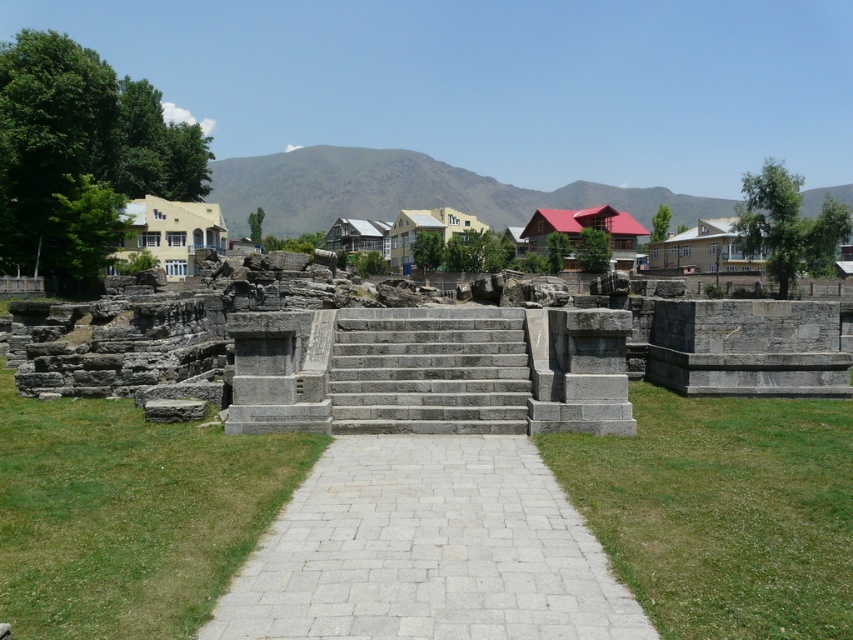
You are standing at the raised platform looking down the stone pathway. There are two points marked on the path. The first is at coordinate point (x=676, y=444) and the second is at coordinate point (x=351, y=388). Which point is closer to you as you stand on the platform?

Point (x=676, y=444) is closer to the camera than point (x=351, y=388), so the first point is closer to you as you stand on the platform.

You are planning to place a picnic blanket on the green grass at lower right and the yellow stucco amphitheater at left. Which area has more space to accommodate the blanket?

The yellow stucco amphitheater at left has more space because the green grass at lower right is smaller than it.

You are a maintenance worker tasked with mowing the lawn. You see the gray stone ruins at center and the green grass at center. Which area should you avoid mowing?

You should avoid mowing the gray stone ruins at center because it is above the green grass at center, indicating it is an elevated structure and not part of the lawn area that needs mowing.